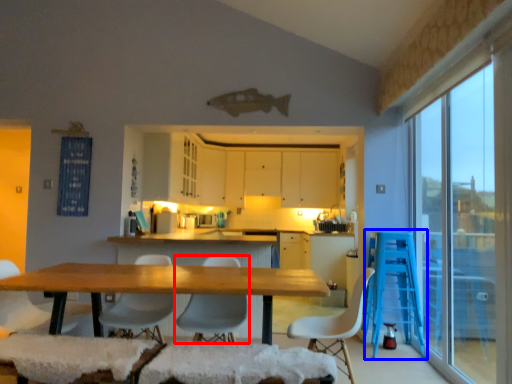
Question: Among these objects, which one is farthest to the camera, chair (highlighted by a red box) or bar stool (highlighted by a blue box)?

Choices:
 (A) chair
 (B) bar stool

Answer: (B)